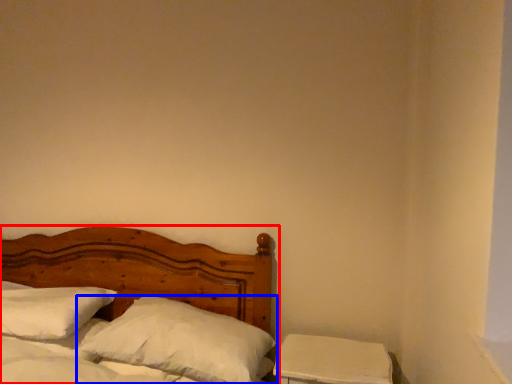
Question: Which of the following is the farthest to the observer, bed (highlighted by a red box) or pillow (highlighted by a blue box)?

Choices:
 (A) bed
 (B) pillow

Answer: (B)